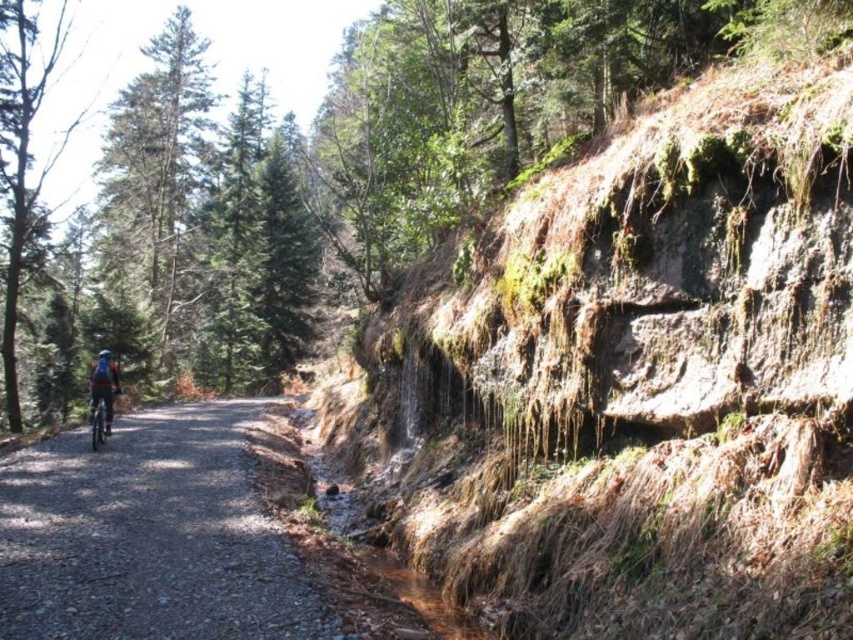
Is point (107, 385) positioned before point (90, 412)?

Yes, point (107, 385) is closer to viewer.

Who is positioned more to the left, blue fabric backpack at center-left or shiny blue bicycle at center?

Positioned to the left is shiny blue bicycle at center.

Where is `blue fabric backpack at center-left`? The height and width of the screenshot is (640, 853). blue fabric backpack at center-left is located at coordinates (103, 385).

Is point (28, 33) less distant than point (94, 369)?

No, (28, 33) is behind (94, 369).

Is green matte tree at left positioned at the back of blue fabric backpack at center-left?

That is True.

Where is `green matte tree at left`? The height and width of the screenshot is (640, 853). green matte tree at left is located at coordinates (22, 154).

Between rusty rock cliff at right and blue fabric backpack at center-left, which one is positioned lower?

blue fabric backpack at center-left is below.

Is rusty rock cliff at right smaller than blue fabric backpack at center-left?

No, rusty rock cliff at right is not smaller than blue fabric backpack at center-left.

Does point (653, 496) come in front of point (90, 392)?

That is True.

I want to click on rusty rock cliff at right, so click(637, 381).